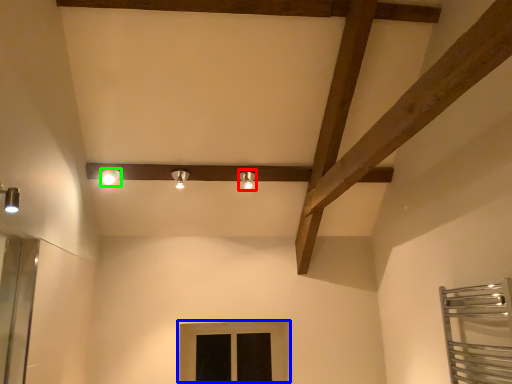
Question: Which object is positioned farthest from light fixture (highlighted by a red box)? Select from window (highlighted by a blue box) and light fixture (highlighted by a green box).

Choices:
 (A) window
 (B) light fixture

Answer: (A)